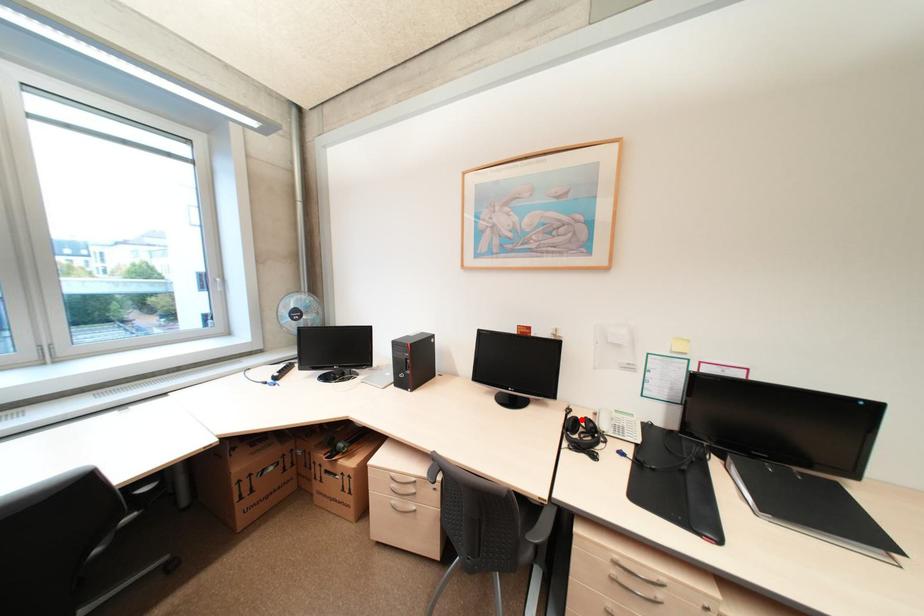
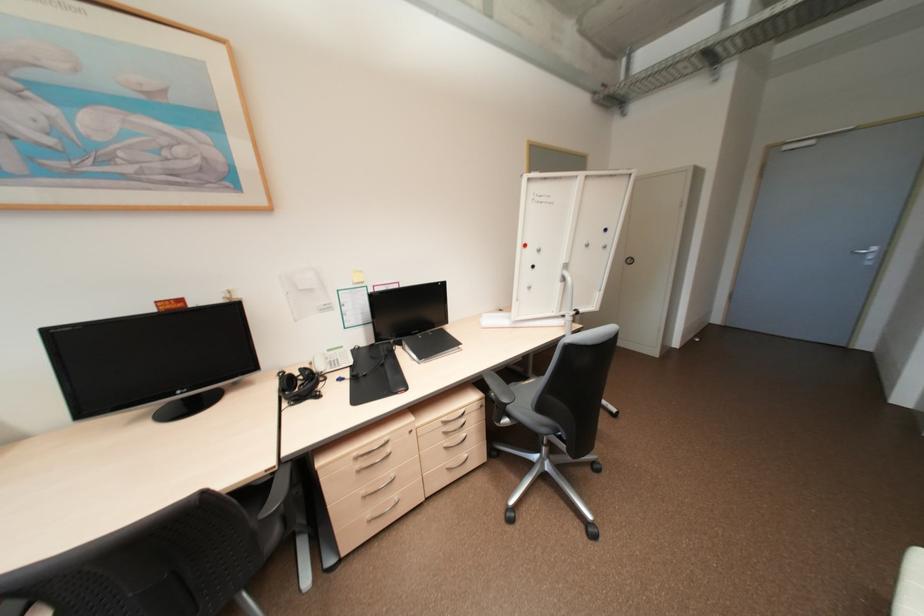
In the second image, find the point that corresponds to the highlighted location in the first image.

(297, 377)